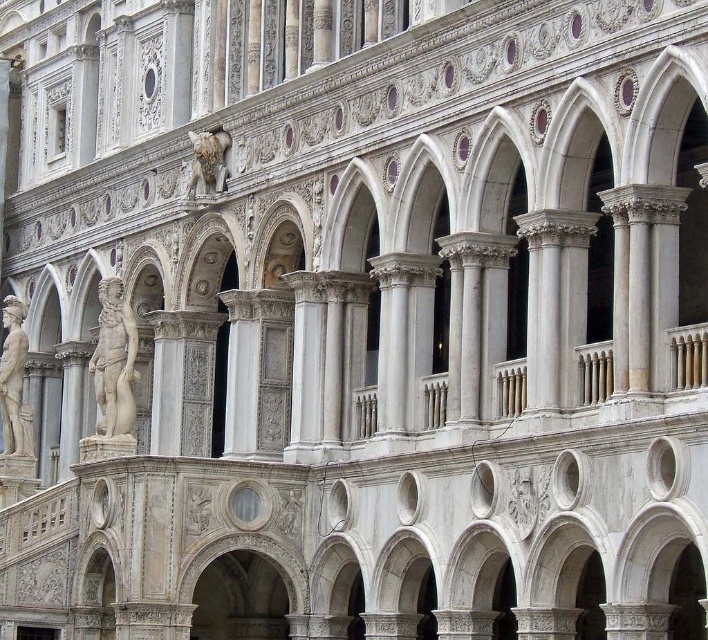
You are standing 1.7 meters tall and looking at the ornate architectural structure. There is a point at coordinates point (118,417). Can you reach this point with your hand if you stand on your tiptoes?

The point at coordinates point (118,417) is 69.33 meters away from the viewer, which is far beyond the reach of a person standing on tiptoes. Therefore, it is impossible to reach this point with your hand.

You are an art conservator examining the facade of this historical building. You notice two white marble statues on the facade. Which of the two statues, the white marble statue at center or the white marble statue at left, is taller?

The white marble statue at left is taller than the white marble statue at center.

You are an art conservator examining the facade of this historical building. You need to clean both the white marble statue at center and the white marble statue at left. Which statue should you clean first if you want to start with the one closer to your current position?

The white marble statue at center is in front of the white marble statue at left, so you should clean the white marble statue at center first as it is closer to your current position.